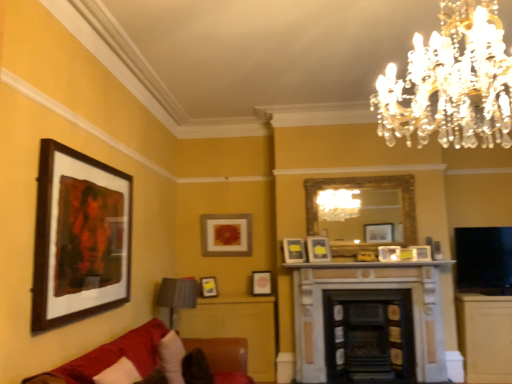
Question: From their relative heights in the image, would you say matte wooden picture frame at center, the second picture frame viewed from the back, is taller or shorter than wooden framed artwork at left, marked as the 8th picture frame in a right-to-left arrangement?

Choices:
 (A) tall
 (B) short

Answer: (B)

Question: From a real-world perspective, is matte wooden picture frame at center, positioned as the fourth picture frame in left-to-right order, physically located above or below wooden framed artwork at left, the first picture frame in the front-to-back sequence?

Choices:
 (A) above
 (B) below

Answer: (B)

Question: Which of these objects is positioned closest to the stone fireplace at center, the first fireplace in the left-to-right sequence?

Choices:
 (A) brown fuzzy pillow at lower left, the 1th pillow in the right-to-left sequence
 (B) matte yellow picture frame at center, positioned as the sixth picture frame in back-to-front order
 (C) velvet red couch at lower left
 (D) matte white picture frame at center, which appears as the fourth picture frame when viewed from the back
 (E) matte gold picture frame at center, marked as the 1th picture frame in a back-to-front arrangement

Answer: (B)

Question: Which object is the closest to the stone fireplace at center, the 2th fireplace viewed from the right?

Choices:
 (A) dark brown wood fireplace at center, placed as the second fireplace when sorted from left to right
 (B) matte white picture frame at center-right, marked as the second picture frame in a front-to-back arrangement
 (C) matte yellow picture frame at center, the sixth picture frame from the front
 (D) matte white picture frame at center, which appears as the fourth picture frame when viewed from the back
 (E) white marble fireplace at center

Answer: (A)